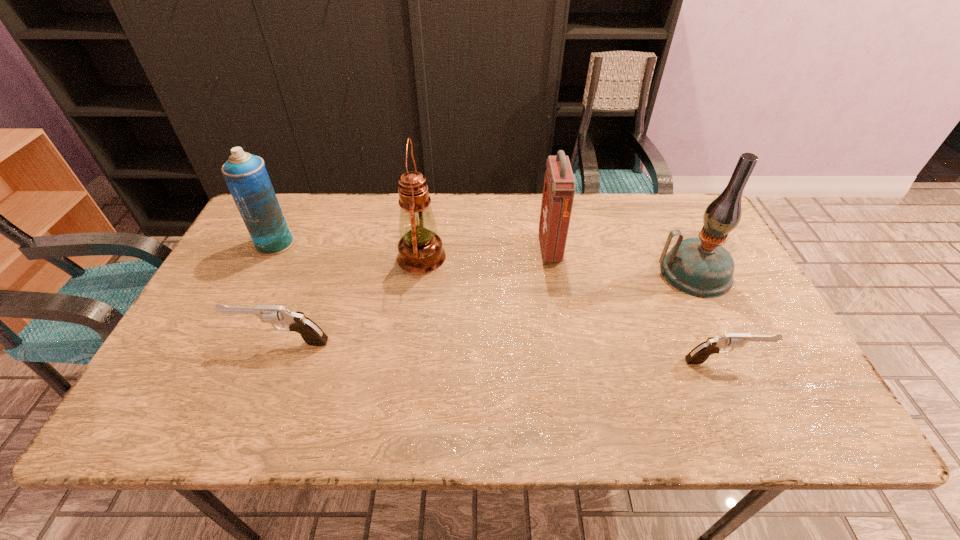
Where is `object identified as the fifth closest to the aerosol can`? The image size is (960, 540). object identified as the fifth closest to the aerosol can is located at coordinates (698, 355).

Locate an element on the screen. The width and height of the screenshot is (960, 540). vacant area in the image that satisfies the following two spatial constraints: 1. on the front side of the right oil lamp; 2. on the left side of the fourth object from right to left is located at coordinates (420, 273).

Locate an element on the screen. The image size is (960, 540). free space that satisfies the following two spatial constraints: 1. on the front-facing side of the fourth object from left to right; 2. on the right side of the right oil lamp is located at coordinates (554, 273).

Identify the location of free point that satisfies the following two spatial constraints: 1. on the front-facing side of the right oil lamp; 2. on the left side of the first-aid kit. (554, 273).

This screenshot has width=960, height=540. I want to click on free spot that satisfies the following two spatial constraints: 1. on the front-facing side of the right oil lamp; 2. on the left side of the fourth object from left to right, so click(x=554, y=273).